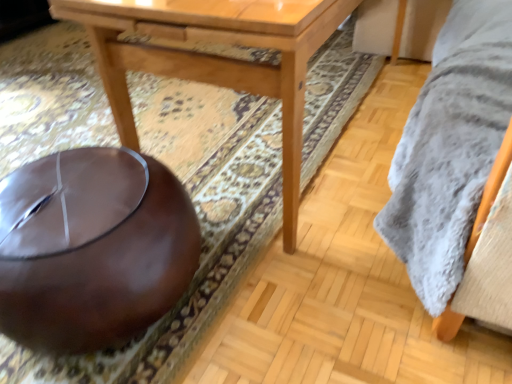
The height and width of the screenshot is (384, 512). What do you see at coordinates (214, 58) in the screenshot? I see `light brown wood table at center` at bounding box center [214, 58].

Where is `light brown wood table at center`? The image size is (512, 384). light brown wood table at center is located at coordinates (214, 58).

Describe the element at coordinates (92, 249) in the screenshot. I see `brown leather bean bag at lower left` at that location.

This screenshot has width=512, height=384. Find the location of `brown leather bean bag at lower left`. brown leather bean bag at lower left is located at coordinates (92, 249).

Locate an element on the screen. light brown wood table at center is located at coordinates (214, 58).

Is light brown wood table at center to the right of brown leather bean bag at lower left from the viewer's perspective?

Indeed, light brown wood table at center is positioned on the right side of brown leather bean bag at lower left.

Considering their positions, is light brown wood table at center located in front of or behind brown leather bean bag at lower left?

Clearly, light brown wood table at center is behind brown leather bean bag at lower left.

Is point (151, 64) closer to viewer compared to point (6, 292)?

No, (151, 64) is further to viewer.

From the image's perspective, is light brown wood table at center above brown leather bean bag at lower left?

Correct, light brown wood table at center appears higher than brown leather bean bag at lower left in the image.

Looking at this image, from a real-world perspective, is light brown wood table at center positioned over brown leather bean bag at lower left based on gravity?

Yes.

Considering the sizes of light brown wood table at center and brown leather bean bag at lower left in the image, is light brown wood table at center wider or thinner than brown leather bean bag at lower left?

Considering their sizes, light brown wood table at center looks broader than brown leather bean bag at lower left.

Considering the sizes of objects light brown wood table at center and brown leather bean bag at lower left in the image provided, who is taller, light brown wood table at center or brown leather bean bag at lower left?

light brown wood table at center is taller.

Considering the sizes of light brown wood table at center and brown leather bean bag at lower left in the image, is light brown wood table at center bigger or smaller than brown leather bean bag at lower left?

light brown wood table at center is bigger than brown leather bean bag at lower left.

Which is correct: light brown wood table at center is inside brown leather bean bag at lower left, or outside of it?

light brown wood table at center is not inside brown leather bean bag at lower left, it's outside.

Is light brown wood table at center with brown leather bean bag at lower left?

They are not placed beside each other.

Is light brown wood table at center positioned with its back to brown leather bean bag at lower left?

No, brown leather bean bag at lower left is not at the back of light brown wood table at center.

How many degrees apart are the facing directions of light brown wood table at center and brown leather bean bag at lower left?

1.21 degrees.

The height and width of the screenshot is (384, 512). What are the coordinates of `table lying on the right of brown leather bean bag at lower left` in the screenshot? It's located at (214, 58).

Considering the relative positions of brown leather bean bag at lower left and light brown wood table at center in the image provided, is brown leather bean bag at lower left to the left or to the right of light brown wood table at center?

brown leather bean bag at lower left is to the left of light brown wood table at center.

Is brown leather bean bag at lower left in front of or behind light brown wood table at center in the image?

brown leather bean bag at lower left is positioned closer to the viewer than light brown wood table at center.

Does point (173, 181) come in front of point (206, 65)?

No, (173, 181) is behind (206, 65).

From the image's perspective, which one is positioned higher, brown leather bean bag at lower left or light brown wood table at center?

light brown wood table at center is shown above in the image.

From a real-world perspective, relative to light brown wood table at center, is brown leather bean bag at lower left vertically above or below?

brown leather bean bag at lower left is situated lower than light brown wood table at center in the real world.

Which of these two, brown leather bean bag at lower left or light brown wood table at center, is thinner?

Thinner between the two is brown leather bean bag at lower left.

Does brown leather bean bag at lower left have a lesser height compared to light brown wood table at center?

Yes, brown leather bean bag at lower left is shorter than light brown wood table at center.

Which of these two, brown leather bean bag at lower left or light brown wood table at center, is bigger?

With larger size is light brown wood table at center.

Is brown leather bean bag at lower left not within light brown wood table at center?

Yes.

Are brown leather bean bag at lower left and light brown wood table at center making contact?

They are not placed beside each other.

Does brown leather bean bag at lower left turn towards light brown wood table at center?

No, brown leather bean bag at lower left is not aimed at light brown wood table at center.

How many degrees apart are the facing directions of brown leather bean bag at lower left and light brown wood table at center?

1.21 degrees separate the facing orientations of brown leather bean bag at lower left and light brown wood table at center.

Locate an element on the screen. Image resolution: width=512 pixels, height=384 pixels. table above the brown leather bean bag at lower left (from the image's perspective) is located at coordinates (214, 58).

Find the location of a particular element. The width and height of the screenshot is (512, 384). bean bag chair that is on the left side of light brown wood table at center is located at coordinates (92, 249).

Identify the location of table that is behind the brown leather bean bag at lower left. (214, 58).